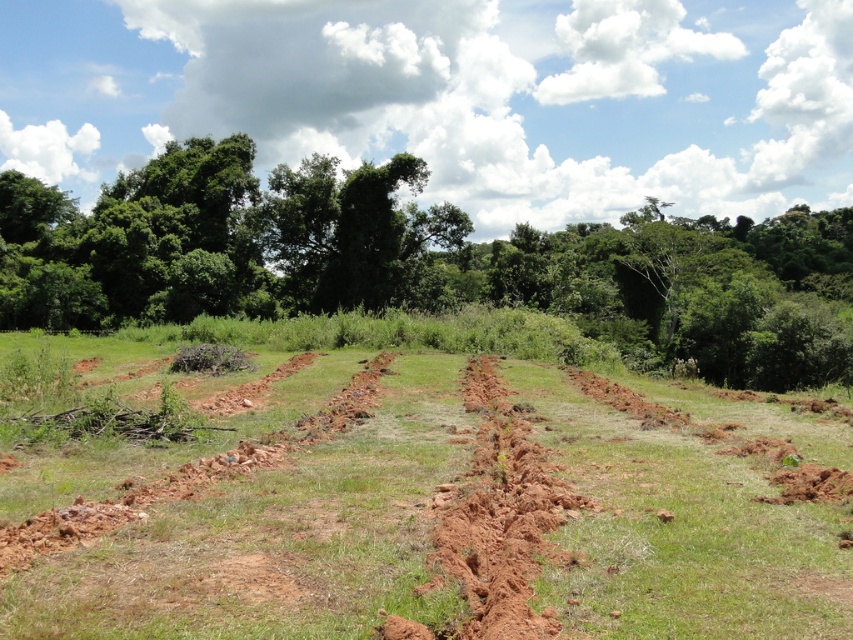
Question: Can you confirm if brown soil at center is thinner than green leafy tree at center?

Choices:
 (A) yes
 (B) no

Answer: (A)

Question: Can you confirm if brown soil at center is bigger than green leafy tree at center?

Choices:
 (A) no
 (B) yes

Answer: (A)

Question: Is brown soil at center below green leafy tree at center?

Choices:
 (A) no
 (B) yes

Answer: (B)

Question: Which point is farther to the camera?

Choices:
 (A) brown soil at center
 (B) green leafy tree at center

Answer: (B)

Question: Which of the following is the farthest from the observer?

Choices:
 (A) (196, 195)
 (B) (778, 484)

Answer: (A)